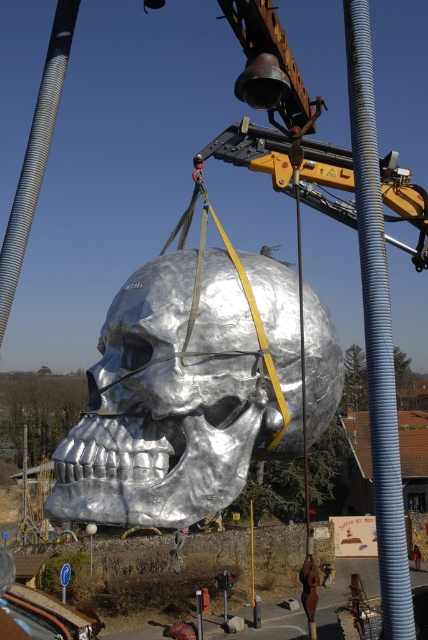
Question: Does gray corrugated pipe at center appear on the right side of brushed metal construction worker at lower center?

Choices:
 (A) yes
 (B) no

Answer: (B)

Question: Can you confirm if shiny metallic skull at center is positioned above brushed metal construction worker at lower center?

Choices:
 (A) yes
 (B) no

Answer: (A)

Question: Which of these objects is positioned closest to the shiny metallic skull at center?

Choices:
 (A) gray corrugated pipe at center
 (B) brushed metal construction worker at lower center

Answer: (A)

Question: Which point is farther to the camera?

Choices:
 (A) (395, 561)
 (B) (413, 550)
 (C) (326, 355)

Answer: (B)

Question: Which point is farther to the camera?

Choices:
 (A) (413, 556)
 (B) (312, 310)

Answer: (A)

Question: Does shiny metallic skull at center have a smaller size compared to brushed metal construction worker at lower center?

Choices:
 (A) yes
 (B) no

Answer: (B)